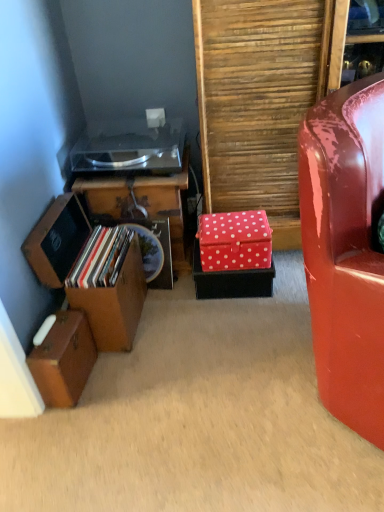
Locate an element on the screen. free location to the right of wooden storage box at left, positioned as the second storage box in right-to-left order is located at coordinates (170, 314).